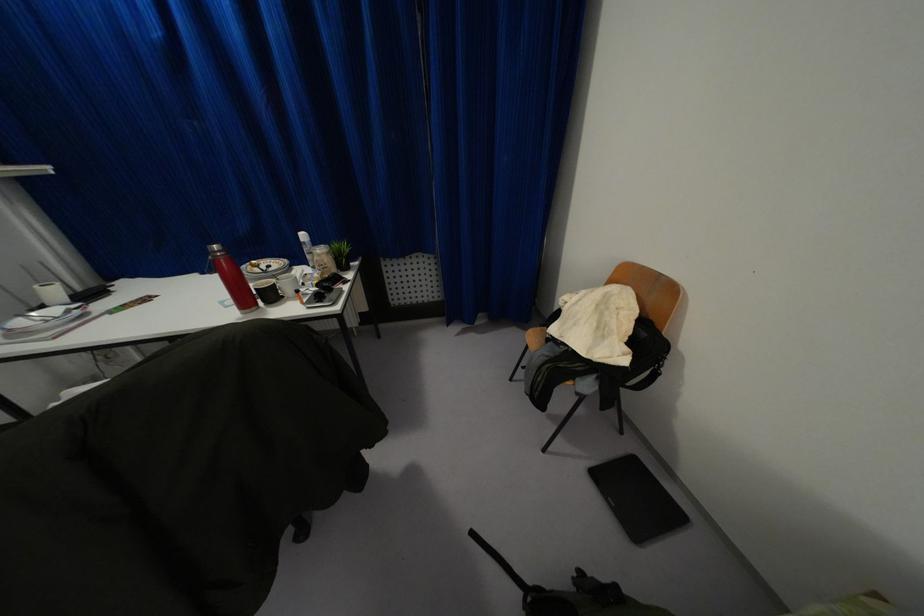
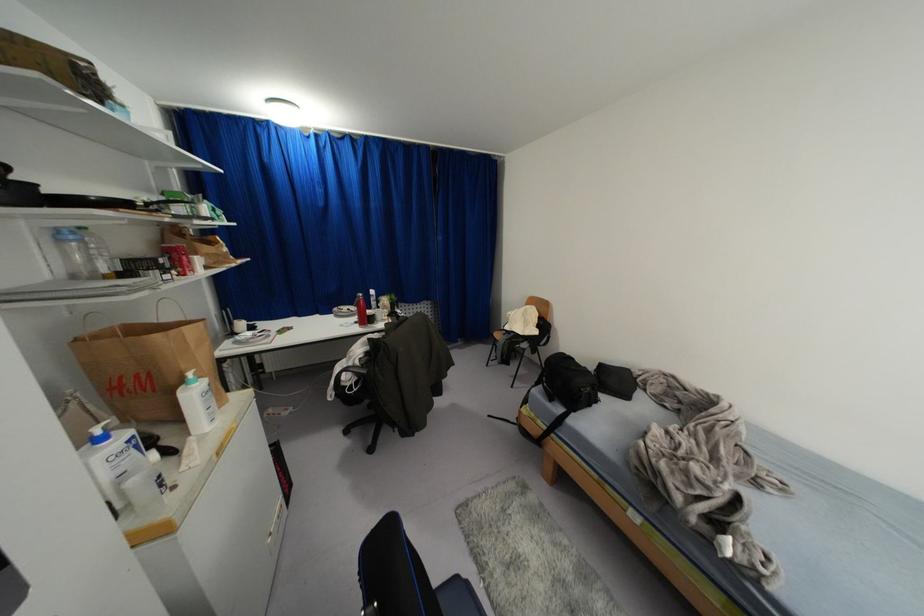
Which direction would the cameraman need to move to produce the second image?

The movement direction of the cameraman is left, backward.